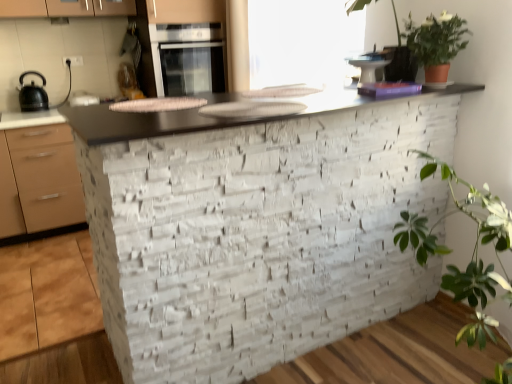
Question: Considering the positions of satin silver oven at upper center and transparent plastic window screen at upper center in the image, is satin silver oven at upper center bigger or smaller than transparent plastic window screen at upper center?

Choices:
 (A) small
 (B) big

Answer: (B)

Question: Choose the correct answer: Is satin silver oven at upper center inside transparent plastic window screen at upper center or outside it?

Choices:
 (A) outside
 (B) inside

Answer: (A)

Question: Which object is positioned closest to the matte black kettle at left?

Choices:
 (A) satin silver oven at upper center
 (B) matte beige cabinetry at upper center
 (C) white stone sink at center
 (D) green matte plant at upper right
 (E) white glossy bowl at upper center

Answer: (A)

Question: Which is farther from the white glossy bowl at upper center?

Choices:
 (A) smooth stone countertop at center
 (B) green matte plant at upper right
 (C) matte black kettle at left
 (D) matte beige cabinetry at upper center
 (E) transparent plastic window screen at upper center

Answer: (C)